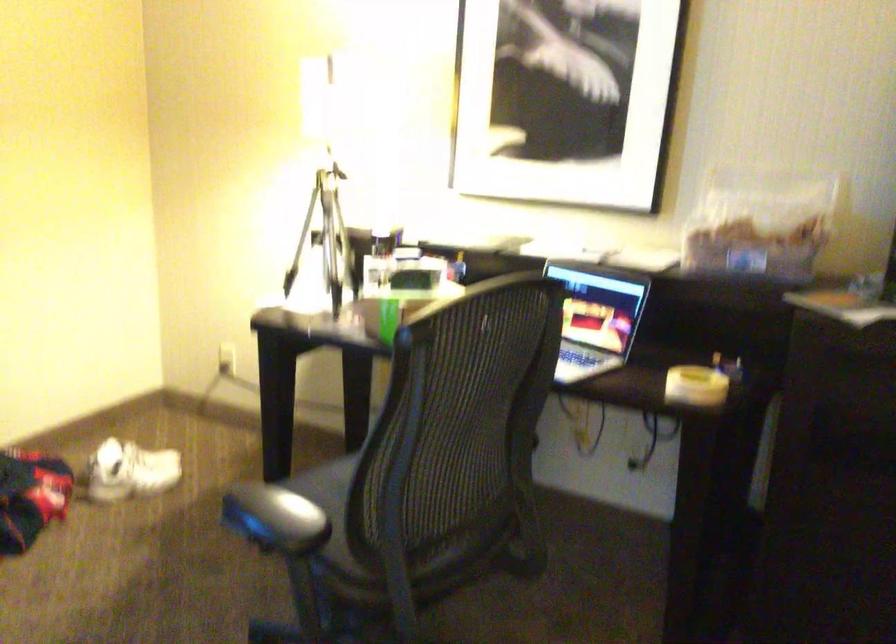
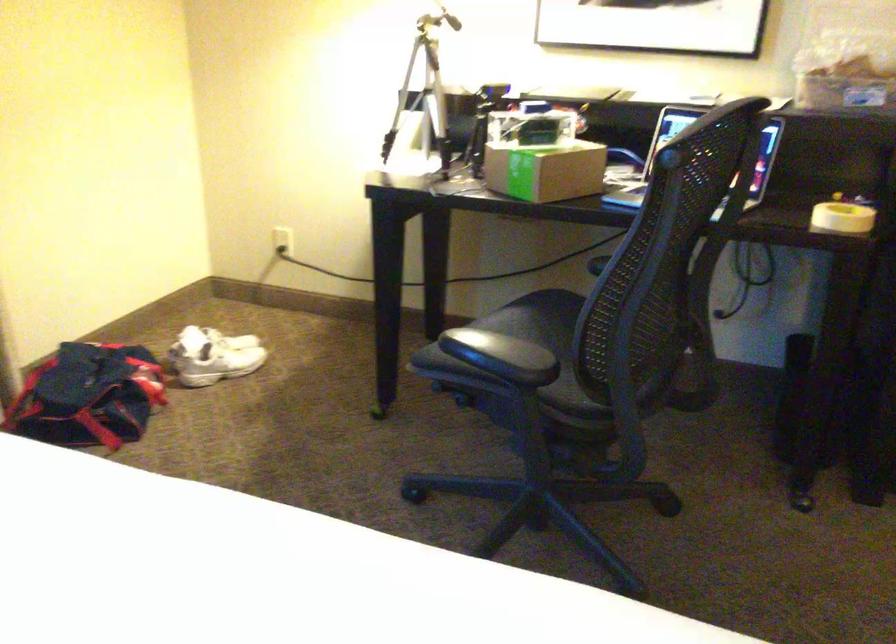
Question: How did the camera likely rotate?

Choices:
 (A) Left
 (B) Right
 (C) Up
 (D) Down

Answer: (D)